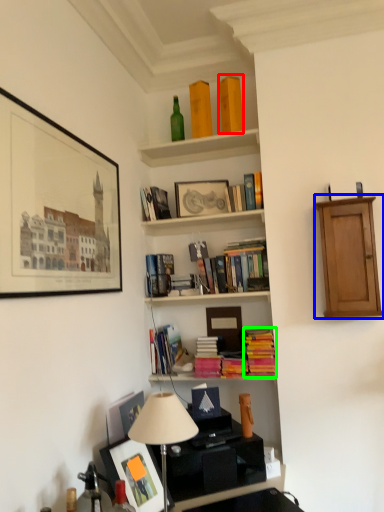
Question: Estimate the real-world distances between objects in this image. Which object is closer to book (highlighted by a red box), cabinetry (highlighted by a blue box) or book (highlighted by a green box)?

Choices:
 (A) cabinetry
 (B) book

Answer: (A)